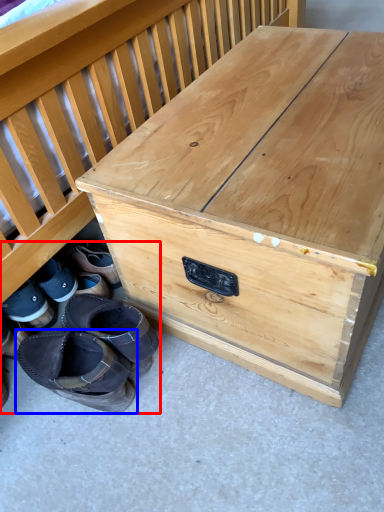
Question: Which object appears closest to the camera in this image, footwear (highlighted by a red box) or footwear (highlighted by a blue box)?

Choices:
 (A) footwear
 (B) footwear

Answer: (A)